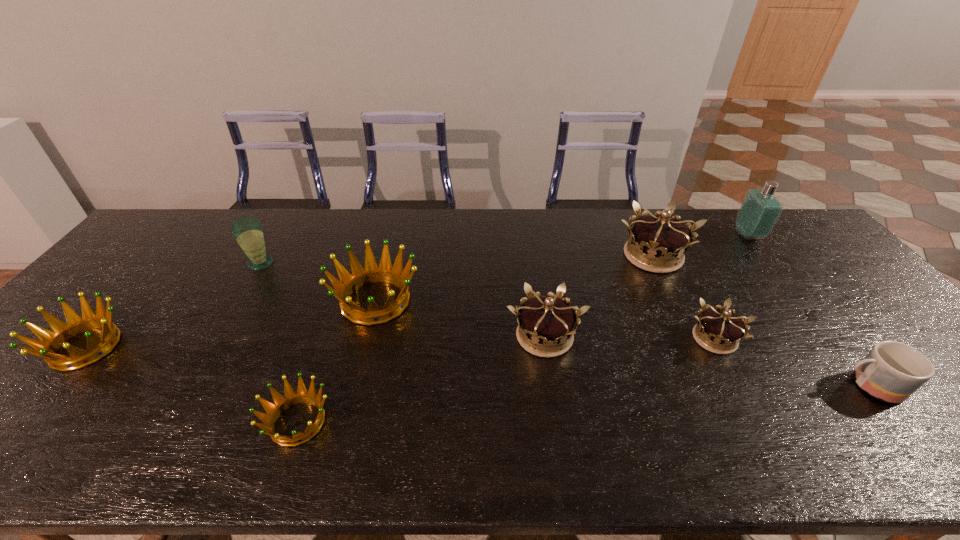
In order to click on perfume in this screenshot , I will do `click(760, 209)`.

Locate an element on the screen. The height and width of the screenshot is (540, 960). the biggest gold crown is located at coordinates (657, 243).

This screenshot has width=960, height=540. I want to click on the farthest gold crown, so click(657, 243).

The height and width of the screenshot is (540, 960). I want to click on the second object from left to right, so click(x=248, y=232).

Where is `glass`? The image size is (960, 540). glass is located at coordinates tap(248, 232).

Find the location of a particular element. This screenshot has width=960, height=540. the third crown from right to left is located at coordinates (548, 320).

This screenshot has width=960, height=540. What are the coordinates of `the fifth object from right to left` in the screenshot? It's located at (548, 320).

Image resolution: width=960 pixels, height=540 pixels. Find the location of `the biggest golden crown`. the biggest golden crown is located at coordinates (371, 273).

The image size is (960, 540). I want to click on the smallest gold crown, so click(x=719, y=331).

Find the location of a particular element. This screenshot has height=540, width=960. the leftmost crown is located at coordinates (51, 341).